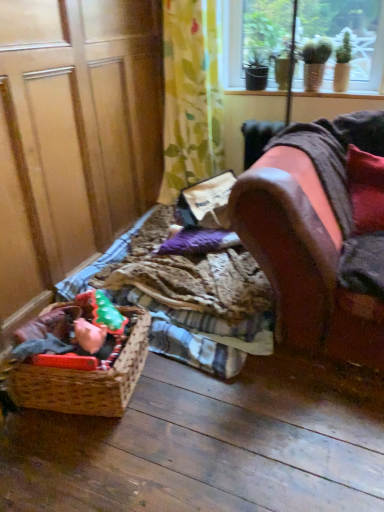
Question: From the image's perspective, is plaid fabric at lower left beneath leather couch at right?

Choices:
 (A) no
 (B) yes

Answer: (B)

Question: Is the position of plaid fabric at lower left more distant than that of leather couch at right?

Choices:
 (A) no
 (B) yes

Answer: (B)

Question: Is plaid fabric at lower left wider than leather couch at right?

Choices:
 (A) no
 (B) yes

Answer: (B)

Question: Could you tell me if plaid fabric at lower left is facing leather couch at right?

Choices:
 (A) no
 (B) yes

Answer: (A)

Question: Can you confirm if plaid fabric at lower left is taller than leather couch at right?

Choices:
 (A) no
 (B) yes

Answer: (A)

Question: In terms of height, does white painted wood at upper center look taller or shorter compared to green floral fabric at upper center?

Choices:
 (A) tall
 (B) short

Answer: (B)

Question: Relative to green floral fabric at upper center, is white painted wood at upper center in front or behind?

Choices:
 (A) front
 (B) behind

Answer: (B)

Question: Based on their positions, is white painted wood at upper center located to the left or right of green floral fabric at upper center?

Choices:
 (A) left
 (B) right

Answer: (B)

Question: From a real-world perspective, is white painted wood at upper center positioned above or below green floral fabric at upper center?

Choices:
 (A) below
 (B) above

Answer: (B)

Question: Is leather couch at right taller or shorter than green floral fabric at upper center?

Choices:
 (A) tall
 (B) short

Answer: (B)

Question: Is leather couch at right in front of or behind green floral fabric at upper center in the image?

Choices:
 (A) front
 (B) behind

Answer: (A)

Question: Is leather couch at right inside or outside of green floral fabric at upper center?

Choices:
 (A) outside
 (B) inside

Answer: (A)

Question: Is leather couch at right bigger or smaller than green floral fabric at upper center?

Choices:
 (A) small
 (B) big

Answer: (B)

Question: Based on their sizes in the image, would you say velvet red pillow at right is bigger or smaller than plaid fabric at lower left?

Choices:
 (A) small
 (B) big

Answer: (A)

Question: Based on their positions, is velvet red pillow at right located to the left or right of plaid fabric at lower left?

Choices:
 (A) right
 (B) left

Answer: (A)